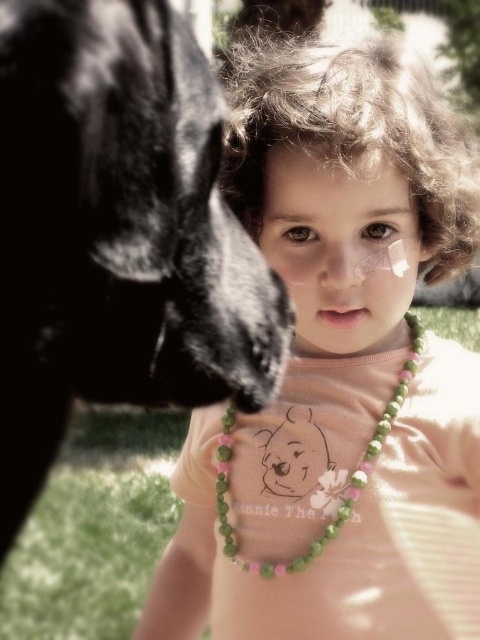
The child is wearing a pink matte necklace at upper center and has a matte skin nose at center. Which of these is located lower on the child?

The pink matte necklace at upper center is positioned under the matte skin nose at center, so the pink matte necklace at upper center is lower than the matte skin nose at center.